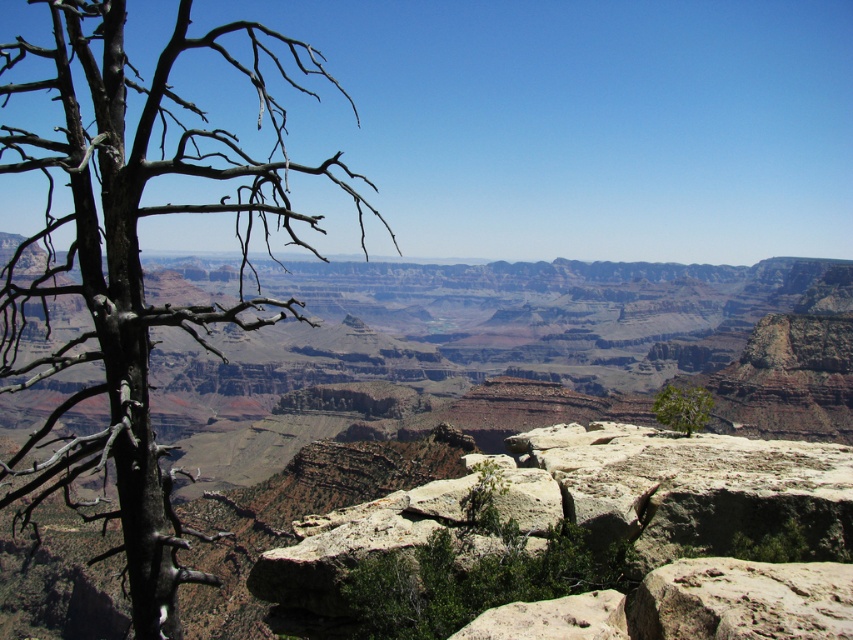
Question: Can you confirm if brown/drytree at left is positioned to the right of green leafy tree at center?

Choices:
 (A) yes
 (B) no

Answer: (B)

Question: Which object appears closest to the camera in this image?

Choices:
 (A) brown/drytree at left
 (B) green leafy tree at center

Answer: (A)

Question: Is brown/drytree at left bigger than green leafy tree at center?

Choices:
 (A) yes
 (B) no

Answer: (A)

Question: Where is brown/drytree at left located in relation to green leafy tree at center in the image?

Choices:
 (A) above
 (B) below

Answer: (A)

Question: Which object is farther from the camera taking this photo?

Choices:
 (A) brown/drytree at left
 (B) green leafy tree at center

Answer: (B)